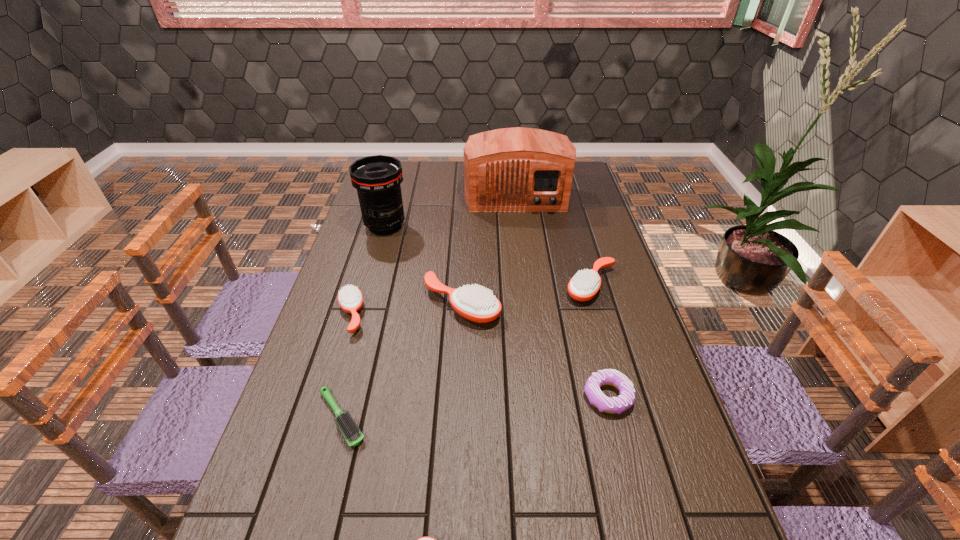
Select which hairbrush is the second closest to the leftmost orange hairbrush. Please provide its 2D coordinates. Your answer should be formatted as a tuple, i.e. [(x, y)], where the tuple contains the x and y coordinates of a point satisfying the conditions above.

[(349, 429)]

Locate an element on the screen. the fourth closest hairbrush to the light hairbrush is located at coordinates (585, 284).

At what (x,y) coordinates should I click in order to perform the action: click on orange hairbrush that can be found as the third closest to the nearest object. Please return your answer as a coordinate pair (x, y). Looking at the image, I should click on (585, 284).

The height and width of the screenshot is (540, 960). Identify the location of the third closest orange hairbrush to the telephoto lens. (585, 284).

Identify the location of free space that satisfies the following two spatial constraints: 1. on the front side of the fourth shortest hairbrush; 2. on the right side of the telephoto lens. The width and height of the screenshot is (960, 540). (369, 286).

At what (x,y) coordinates should I click in order to perform the action: click on free space that satisfies the following two spatial constraints: 1. on the front side of the telephoto lens; 2. on the right side of the doughnut. Please return your answer as a coordinate pair (x, y). This screenshot has height=540, width=960. Looking at the image, I should click on pyautogui.click(x=337, y=396).